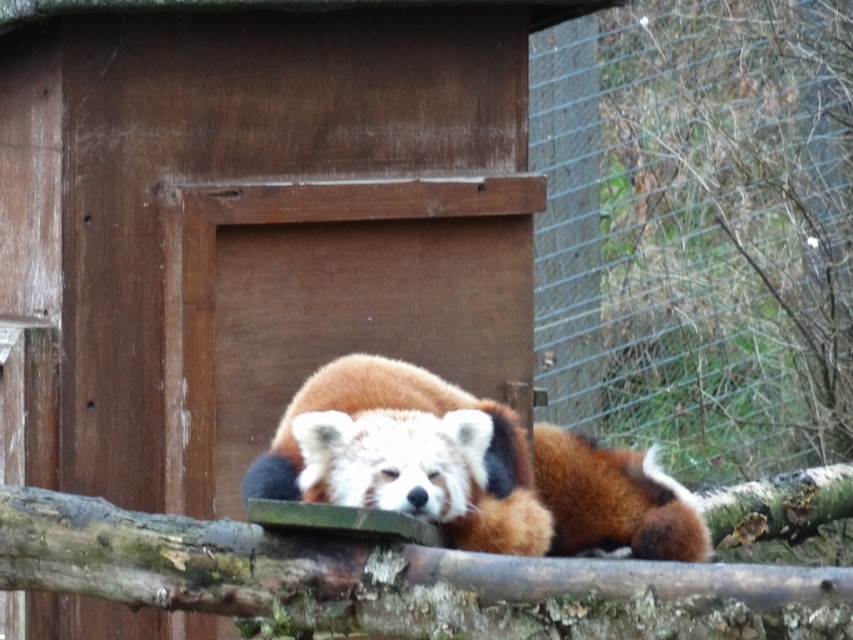
Which is more to the right, brown rough wood at center or fuzzy reddish-brown red panda at center?

Positioned to the right is fuzzy reddish-brown red panda at center.

The width and height of the screenshot is (853, 640). Describe the element at coordinates (398, 580) in the screenshot. I see `brown rough wood at center` at that location.

What do you see at coordinates (398, 580) in the screenshot? I see `brown rough wood at center` at bounding box center [398, 580].

Identify the location of brown rough wood at center. This screenshot has height=640, width=853. (398, 580).